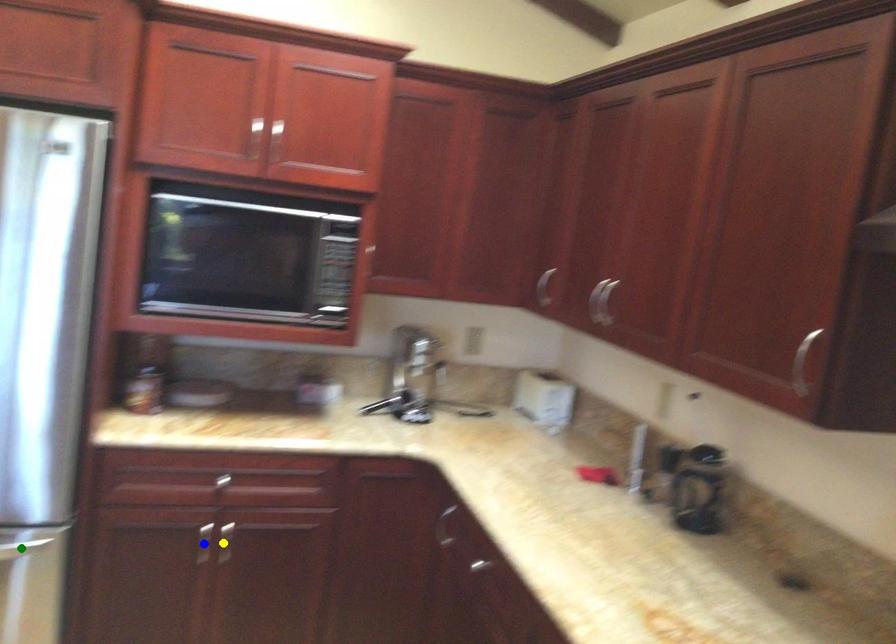
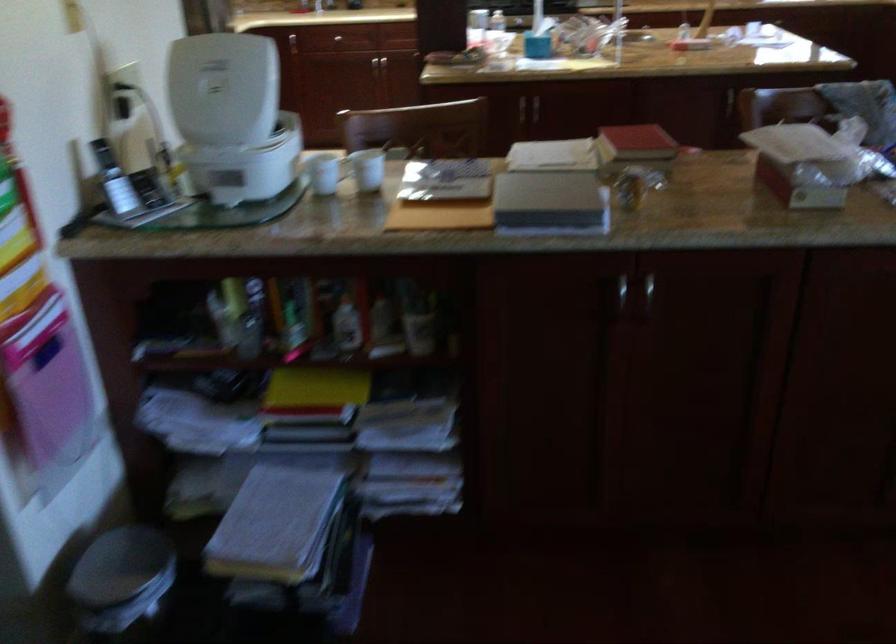
I am providing you with two images of the same scene from different viewpoints. Three points are marked in image1. Which point corresponds to a part or object that is occluded in image2?In image1, three points are marked. Which of them correspond to a part or object that is occluded in image2?Among the three points shown in image1, which one corresponds to a part or object that is no longer visible due to occlusion in image2?

yellow point, green point, blue point cannot be seen in image2.